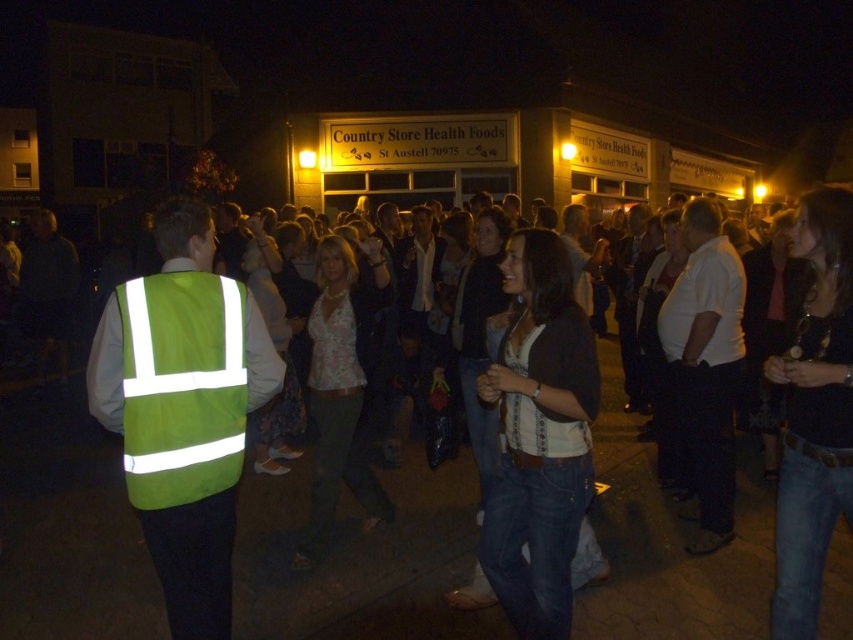
Does point (16, 428) lie in front of point (146, 518)?

No, it is not.

What do you see at coordinates (361, 561) in the screenshot?
I see `jeans at center` at bounding box center [361, 561].

Which is in front, point (622, 588) or point (192, 218)?

Point (192, 218)

Locate an element on the screen. The width and height of the screenshot is (853, 640). jeans at center is located at coordinates (361, 561).

Is point (383, 540) closer to camera compared to point (143, 285)?

No.

Can you confirm if jeans at center is taller than green reflective safety vest at left?

No, jeans at center is not taller than green reflective safety vest at left.

Locate an element on the screen. jeans at center is located at coordinates (361, 561).

Is reflective fabric vest at left bigger than green reflective safety vest at left?

Yes, reflective fabric vest at left is bigger than green reflective safety vest at left.

How distant is reflective fabric vest at left from green reflective safety vest at left?

A distance of 2.45 inches exists between reflective fabric vest at left and green reflective safety vest at left.

Between point (212, 243) and point (233, 394), which one is positioned in front?

Point (233, 394) is in front.

Find the location of `reflective fabric vest at left`. reflective fabric vest at left is located at coordinates (183, 410).